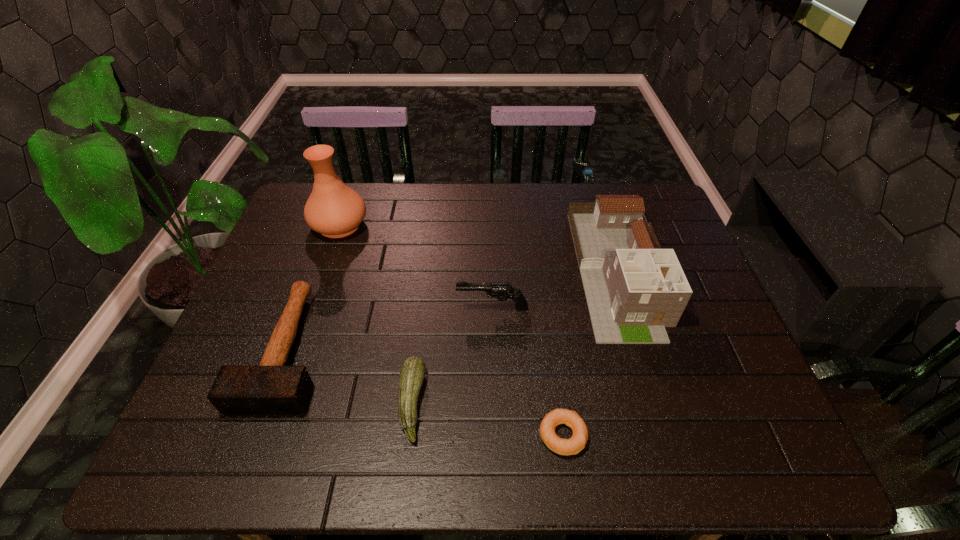
Where is `vase situated at the left edge`? The height and width of the screenshot is (540, 960). vase situated at the left edge is located at coordinates point(333,209).

Find the location of `mallet located in the left edge section of the desktop`. mallet located in the left edge section of the desktop is located at coordinates (271, 388).

The image size is (960, 540). What are the coordinates of `object that is positioned at the right edge` in the screenshot? It's located at (634, 289).

The width and height of the screenshot is (960, 540). I want to click on object that is at the far left corner, so click(x=333, y=209).

You are a GUI agent. You are given a task and a screenshot of the screen. Output one action in this format:
    pyautogui.click(x=<x>, y=<y>)
    Task: Click on the object located in the far right corner section of the desktop
    The height and width of the screenshot is (540, 960).
    Given the screenshot: What is the action you would take?
    pyautogui.click(x=634, y=289)

You are a GUI agent. You are given a task and a screenshot of the screen. Output one action in this format:
    pyautogui.click(x=<x>, y=<y>)
    Task: Click on the vacant space at the far edge of the desktop
    This screenshot has width=960, height=540.
    Given the screenshot: What is the action you would take?
    pyautogui.click(x=509, y=213)

Find the location of a particular element. vacant region at the near edge of the desktop is located at coordinates (641, 445).

The width and height of the screenshot is (960, 540). Identify the location of vacant space at the left edge of the desktop. (276, 320).

Find the location of `free space at the far left corner of the desktop`. free space at the far left corner of the desktop is located at coordinates (307, 194).

In the image, there is a desktop. Where is `vacant region at the far right corner`? The height and width of the screenshot is (540, 960). vacant region at the far right corner is located at coordinates (670, 217).